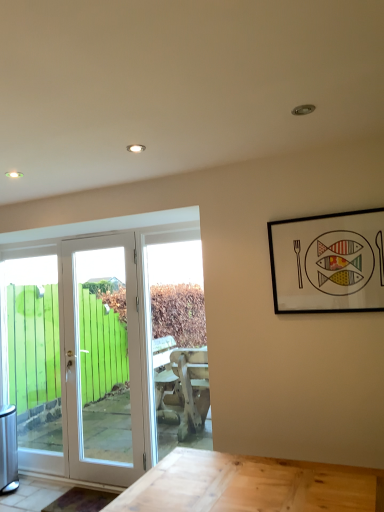
Question: Considering the positions of white glossy door at left, which appears as the first door when viewed from the right, and black matte picture frame at upper right in the image, is white glossy door at left, which appears as the first door when viewed from the right, bigger or smaller than black matte picture frame at upper right?

Choices:
 (A) big
 (B) small

Answer: (A)

Question: Is white glossy door at left, which appears as the first door when viewed from the right, wider or thinner than black matte picture frame at upper right?

Choices:
 (A) thin
 (B) wide

Answer: (B)

Question: Which object is positioned closest to the transparent glass door at left?

Choices:
 (A) white glossy door at left, the 1th door when ordered from left to right
 (B) black matte picture frame at upper right
 (C) white glossy door at left, the second door in the left-to-right sequence

Answer: (A)

Question: Which is nearer to the white glossy door at left, the second door in the left-to-right sequence?

Choices:
 (A) white glossy door at left, positioned as the second door in right-to-left order
 (B) transparent glass door at left
 (C) black matte picture frame at upper right

Answer: (A)